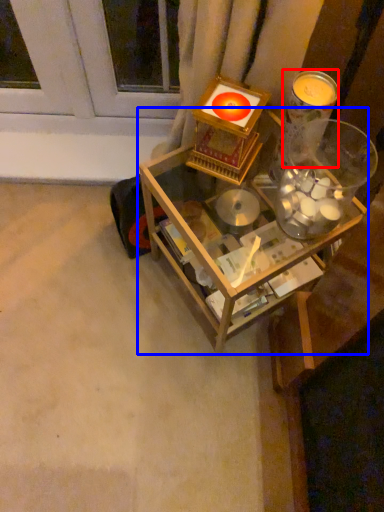
Question: Which object is closer to the camera taking this photo, candle holder (highlighted by a red box) or table (highlighted by a blue box)?

Choices:
 (A) candle holder
 (B) table

Answer: (A)